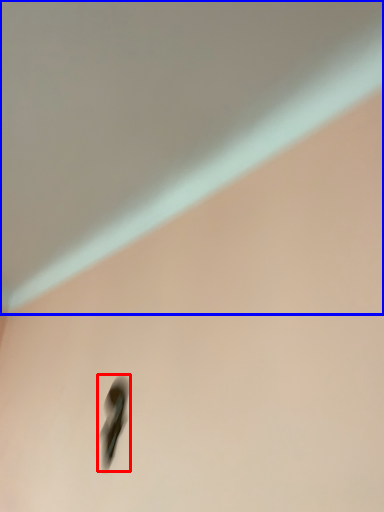
Question: Which point is closer to the camera, footwear (highlighted by a red box) or backdrop (highlighted by a blue box)?

Choices:
 (A) footwear
 (B) backdrop

Answer: (B)